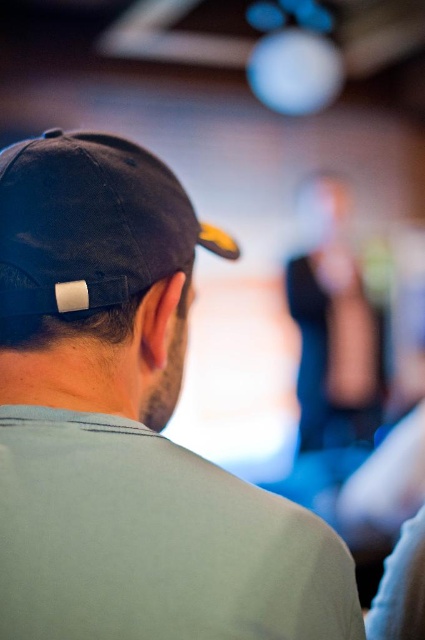
Is point (181, 268) positioned behind point (90, 193)?

That is True.

Is black matte cap at upper left further to camera compared to black fabric baseball cap at upper left?

No, black matte cap at upper left is closer to the viewer.

Between point (198, 611) and point (31, 150), which one is positioned in front?

Point (198, 611)

Where is `black matte cap at upper left`? The image size is (425, 640). black matte cap at upper left is located at coordinates (127, 424).